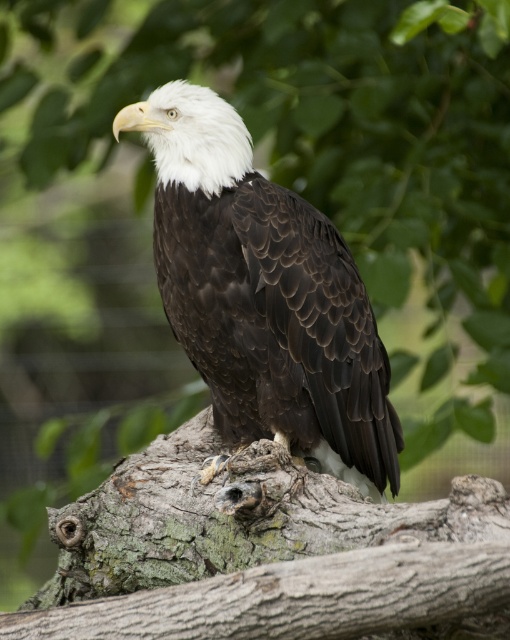
You are an ornithologist observing the bald eagle in the scene. You need to determine which object occupies more space in the image between the rough bark tree trunk at center and the dark brown feathers at center. Which one is larger?

The rough bark tree trunk at center has a larger size compared to dark brown feathers at center, so the rough bark tree trunk at center occupies more space in the image.

You are a birdwatcher observing a bald eagle in a forest. You notice the rough bark tree trunk at center and the dark brown feathers at center. Which object is located to the left of the other?

The rough bark tree trunk at center is positioned on the left side of dark brown feathers at center.